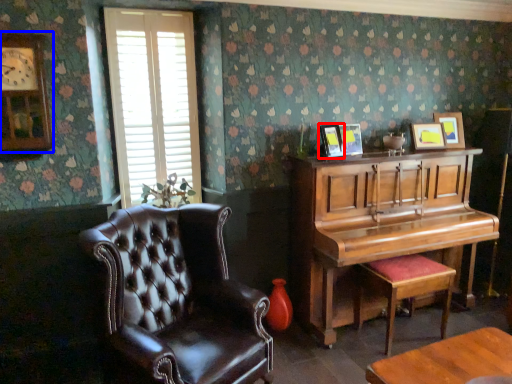
Question: Which point is closer to the camera, picture frame (highlighted by a red box) or clock (highlighted by a blue box)?

Choices:
 (A) picture frame
 (B) clock

Answer: (B)